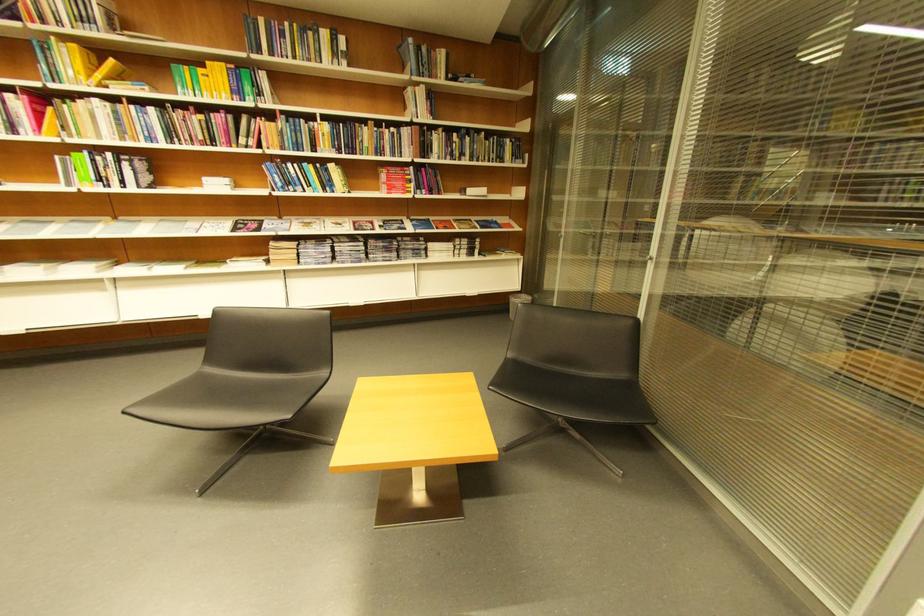
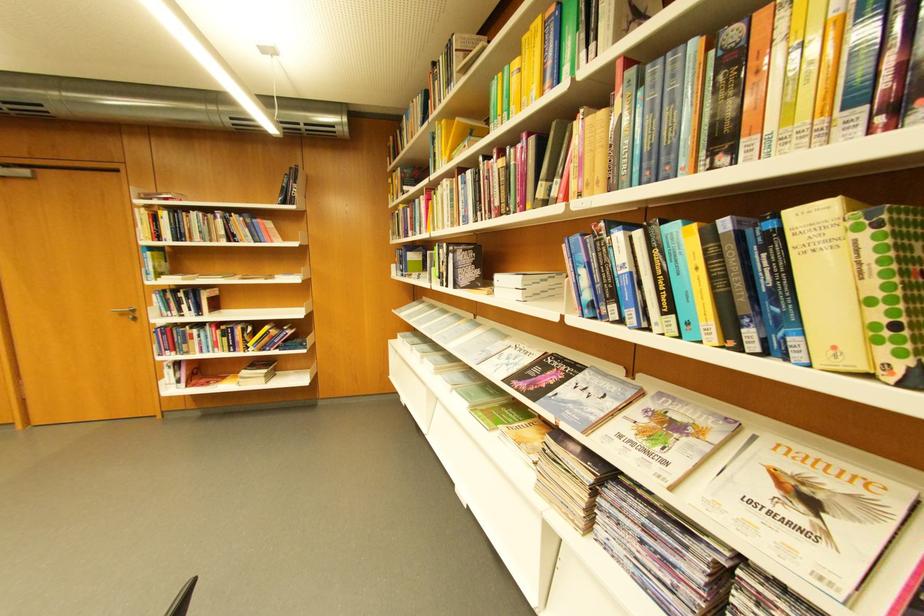
Find the pixel in the second image that matches [344,223] in the first image.

(800, 469)